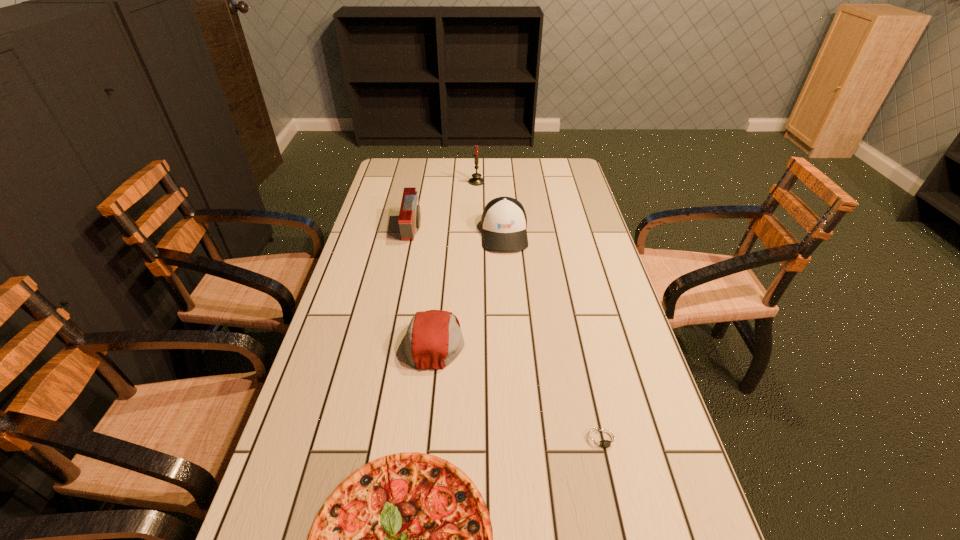
Locate an element on the screen. The height and width of the screenshot is (540, 960). vacant position located on the front-facing side of the camera is located at coordinates (496, 228).

The width and height of the screenshot is (960, 540). I want to click on vacant space located 0.290m on the front panel of the farther cap, so click(x=511, y=319).

This screenshot has height=540, width=960. In order to click on blank space located on the front-facing side of the fourth tallest object in this screenshot , I will do `click(503, 341)`.

This screenshot has width=960, height=540. In order to click on free space located on the face of the second shortest object in this screenshot , I will do `click(624, 530)`.

Locate an element on the screen. This screenshot has height=540, width=960. object present at the far edge is located at coordinates (476, 180).

I want to click on object that is at the left edge, so click(409, 219).

The image size is (960, 540). I want to click on object present at the right edge, so (604, 440).

Locate an element on the screen. This screenshot has height=540, width=960. blank space at the far edge of the desktop is located at coordinates (469, 175).

Image resolution: width=960 pixels, height=540 pixels. Identify the location of free space at the left edge. (330, 389).

I want to click on vacant space at the right edge of the desktop, so click(661, 539).